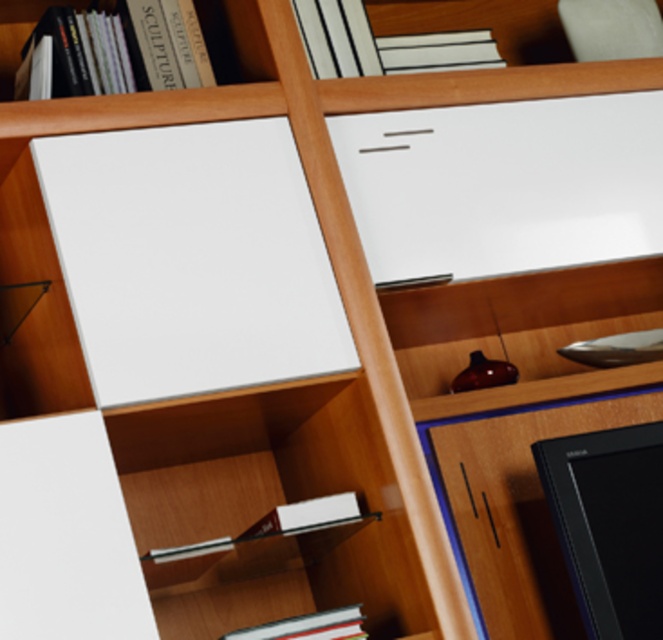
Question: Which point is closer to the camera taking this photo?

Choices:
 (A) (422, 70)
 (B) (339, 515)

Answer: (B)

Question: Based on their relative distances, which object is nearer to the black glossy monitor at lower right?

Choices:
 (A) white glossy book at lower center
 (B) hardcover book at upper center
 (C) white matte board at upper left
 (D) white glossy book at upper center

Answer: (A)

Question: Can you confirm if white matte board at upper left is bigger than white glossy book at upper center?

Choices:
 (A) yes
 (B) no

Answer: (A)

Question: Estimate the real-world distances between objects in this image. Which object is closer to the white glossy book at upper center?

Choices:
 (A) hardcover book at upper center
 (B) hardcover book at lower center
 (C) white matte board at upper left
 (D) black glossy monitor at lower right

Answer: (A)

Question: Where is black glossy monitor at lower right located in relation to white glossy book at upper center in the image?

Choices:
 (A) above
 (B) below

Answer: (B)

Question: Considering the relative positions of white glossy book at lower center and hardcover book at upper center in the image provided, where is white glossy book at lower center located with respect to hardcover book at upper center?

Choices:
 (A) above
 (B) below

Answer: (B)